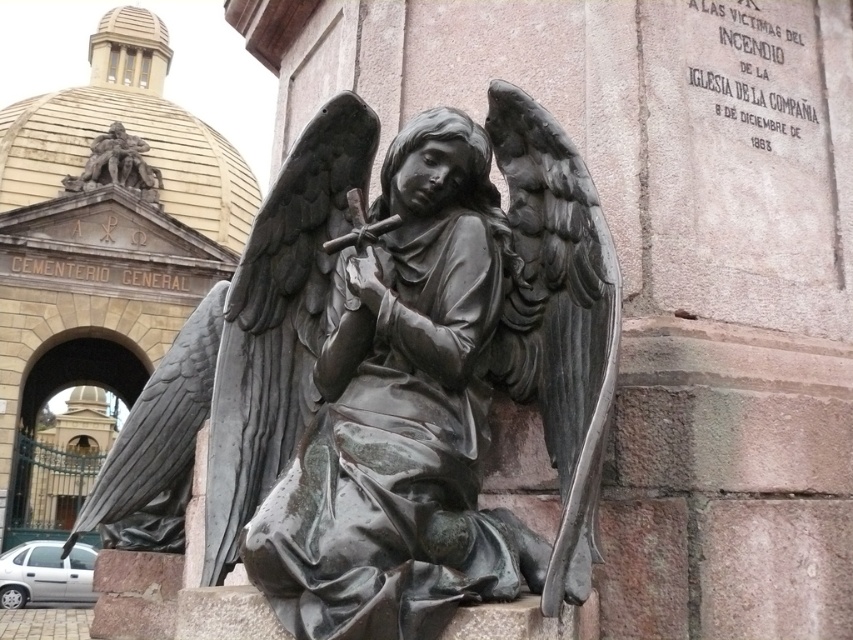
Question: Is bronze statue at center positioned at the back of bronze sculpture at upper left?

Choices:
 (A) yes
 (B) no

Answer: (B)

Question: Does bronze statue at center have a lesser width compared to bronze sculpture at upper left?

Choices:
 (A) yes
 (B) no

Answer: (A)

Question: Which of the following is the farthest from the observer?

Choices:
 (A) (91, 168)
 (B) (474, 483)

Answer: (A)

Question: Which point is farther from the camera taking this photo?

Choices:
 (A) (86, 188)
 (B) (399, 614)

Answer: (A)

Question: Can you confirm if bronze statue at center is positioned to the left of bronze sculpture at upper left?

Choices:
 (A) no
 (B) yes

Answer: (A)

Question: Which of the following is the farthest from the observer?

Choices:
 (A) bronze statue at center
 (B) bronze sculpture at upper left

Answer: (B)